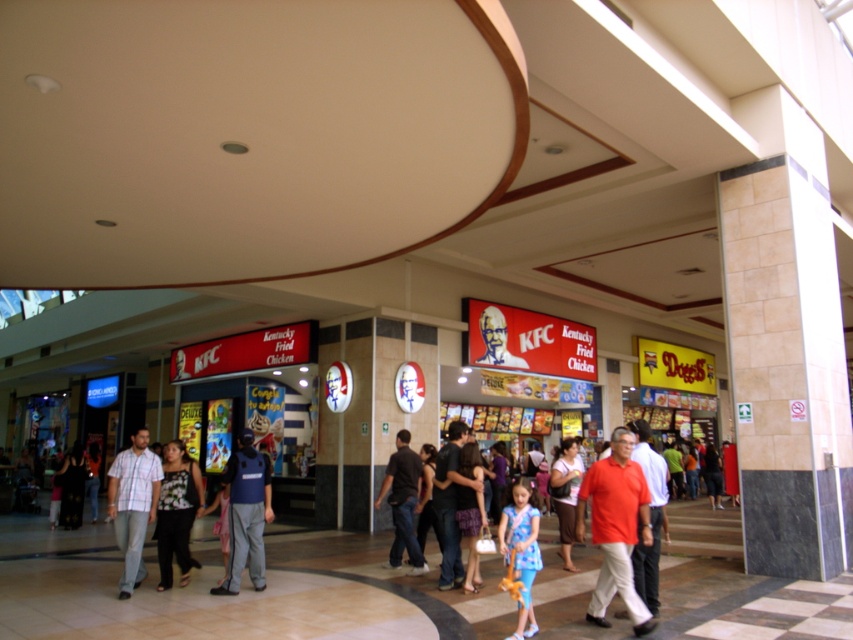
Between blue denim jeans at center and dark brown leather pants at center, which one is positioned lower?

Positioned lower is dark brown leather pants at center.

What do you see at coordinates (521, 554) in the screenshot? This screenshot has width=853, height=640. I see `blue denim jeans at center` at bounding box center [521, 554].

What do you see at coordinates (521, 554) in the screenshot?
I see `blue denim jeans at center` at bounding box center [521, 554].

This screenshot has height=640, width=853. Identify the location of blue denim jeans at center. (521, 554).

Which of these two, plaid shirt at center or matte red shirt at center, stands shorter?

matte red shirt at center

How far apart are plaid shirt at center and matte red shirt at center?

plaid shirt at center and matte red shirt at center are 5.54 meters apart from each other.

Is point (131, 468) farther from camera compared to point (640, 461)?

Yes.

Identify the location of plaid shirt at center. This screenshot has height=640, width=853. tap(132, 504).

Can you confirm if dark blue uniform at center is shorter than blue denim jeans at center?

No.

Which is below, dark blue uniform at center or blue denim jeans at center?

dark blue uniform at center is below.

Measure the distance between point (236, 582) and camera.

A distance of 24.37 feet exists between point (236, 582) and camera.

The height and width of the screenshot is (640, 853). In order to click on dark blue uniform at center in this screenshot , I will do `click(247, 515)`.